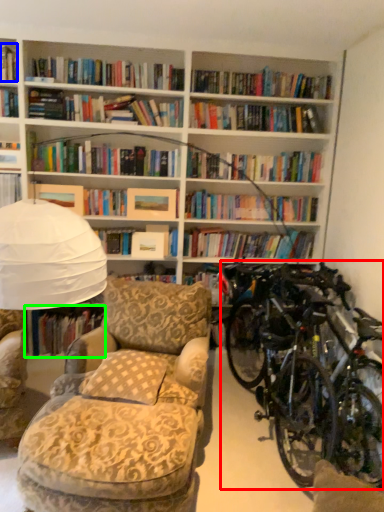
Question: Based on their relative distances, which object is farther from bicycle (highlighted by a red box)? Choose from book (highlighted by a blue box) and book (highlighted by a green box).

Choices:
 (A) book
 (B) book

Answer: (A)